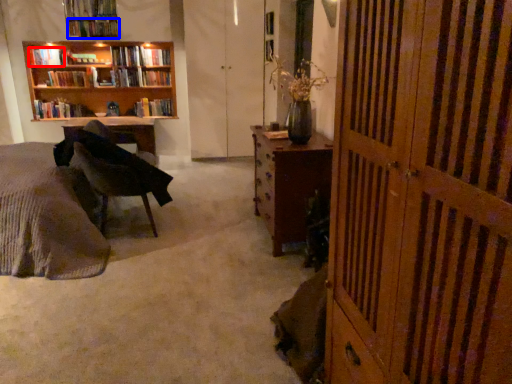
Question: Which of the following is the closest to the observer, book (highlighted by a red box) or book (highlighted by a blue box)?

Choices:
 (A) book
 (B) book

Answer: (B)